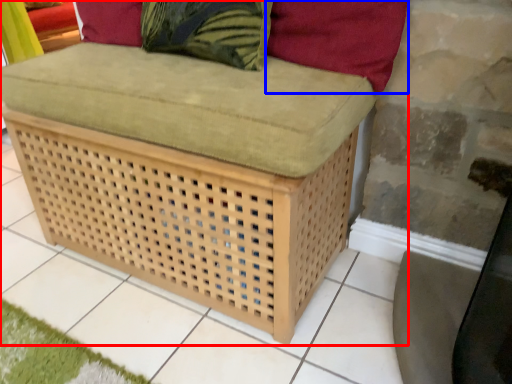
Question: Which point is further to the camera, furniture (highlighted by a red box) or pillow (highlighted by a blue box)?

Choices:
 (A) furniture
 (B) pillow

Answer: (B)